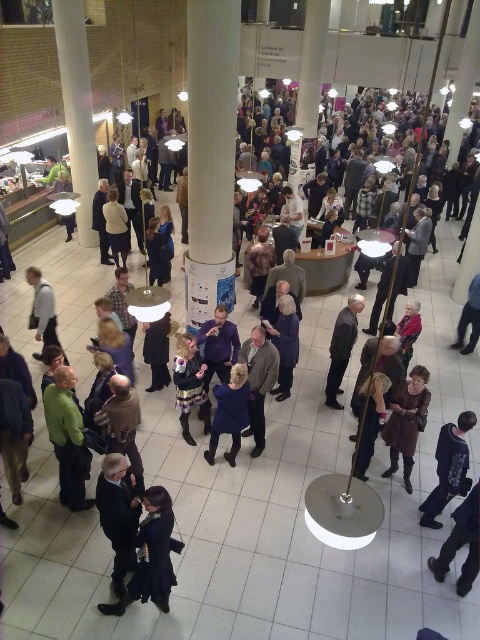
Is point (389, 424) farther from viewer compared to point (215, 449)?

No, it is in front of (215, 449).

Where is `brown leather coat at center`? Image resolution: width=480 pixels, height=640 pixels. brown leather coat at center is located at coordinates (407, 422).

Which is in front, point (254, 390) or point (233, 442)?

Point (254, 390) is more forward.

Can you confirm if dark gray sweater at center is bigger than dark blue wool coat at center?

No.

Does point (274, 371) come in front of point (216, 429)?

No, it is behind (216, 429).

Find the location of a particular element. dark gray sweater at center is located at coordinates (259, 381).

Is dark blue wool coat at center positioned before dark blue fabric coat at center?

Yes, it is.

Is point (216, 422) less distant than point (286, 342)?

Yes.

Does point (228, 422) lie behind point (282, 314)?

No, it is in front of (282, 314).

Identify the location of dark blue wool coat at center. This screenshot has height=640, width=480. (229, 412).